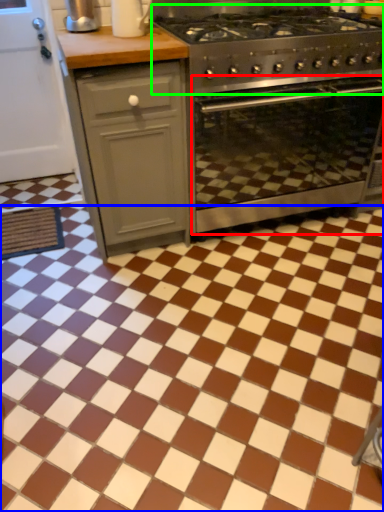
Question: Considering the real-world distances, which object is closest to oven (highlighted by a red box)? ceramic tile (highlighted by a blue box) or gas stove (highlighted by a green box).

Choices:
 (A) ceramic tile
 (B) gas stove

Answer: (B)